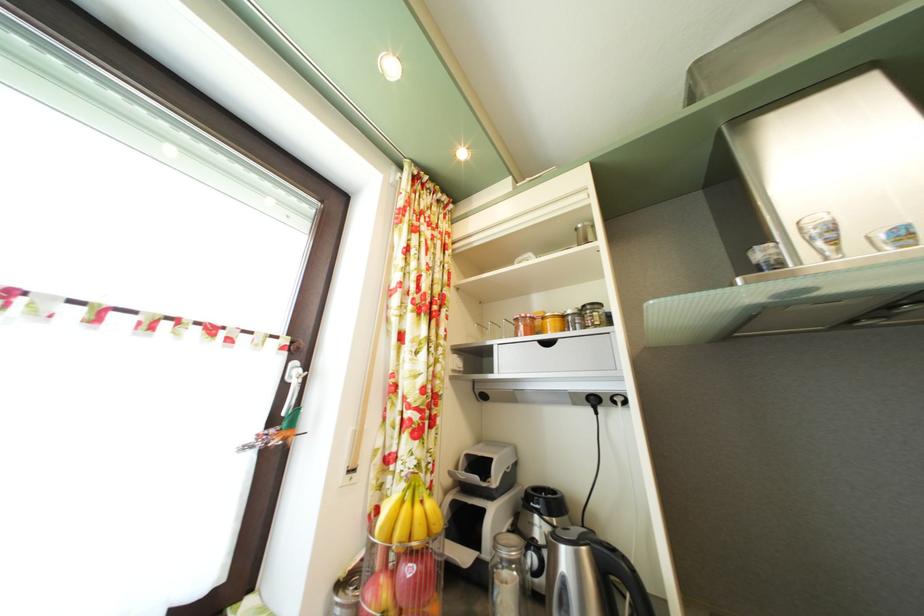
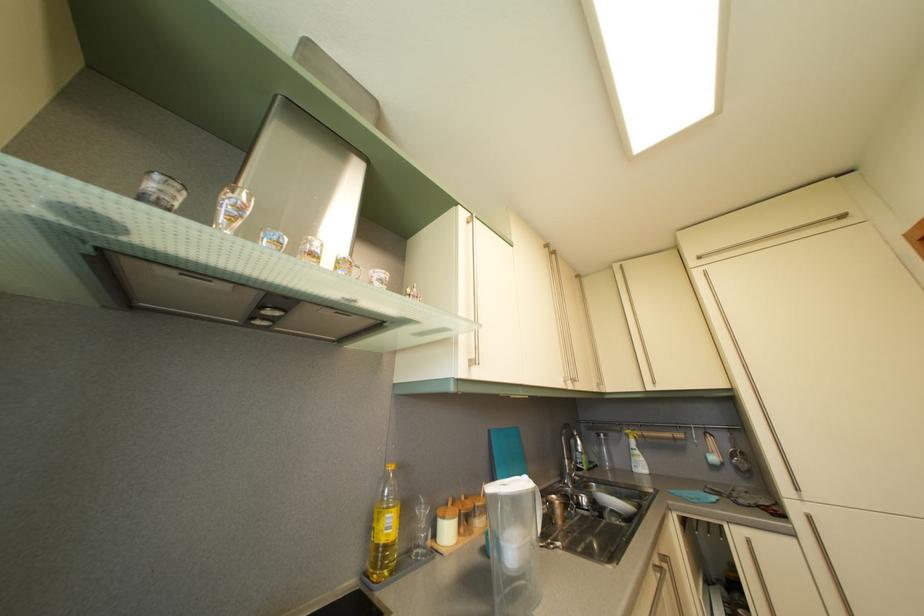
Locate, in the second image, the point that corresponds to (x=781, y=252) in the first image.

(186, 193)